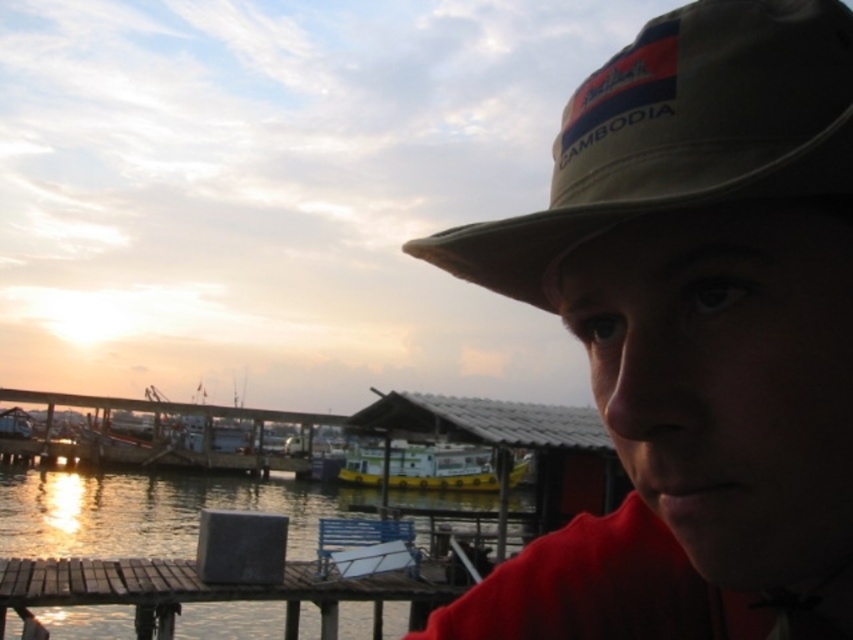
You are standing at the point with coordinates point (212, 611) and want to walk towards the point (796, 243). According to the scene, will you be moving towards the foreground or background?

Since point (796, 243) is in front of point (212, 611), moving towards point (796, 243) means you are moving towards the foreground.